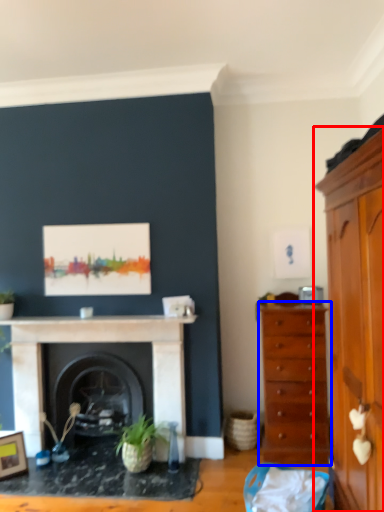
Question: Which point is further to the camera, cabinetry (highlighted by a red box) or chest of drawers (highlighted by a blue box)?

Choices:
 (A) cabinetry
 (B) chest of drawers

Answer: (B)